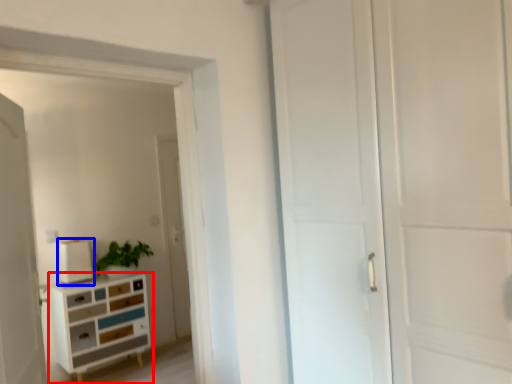
Question: Which object appears farthest to the camera in this image, chest of drawers (highlighted by a red box) or appliance (highlighted by a blue box)?

Choices:
 (A) chest of drawers
 (B) appliance

Answer: (B)